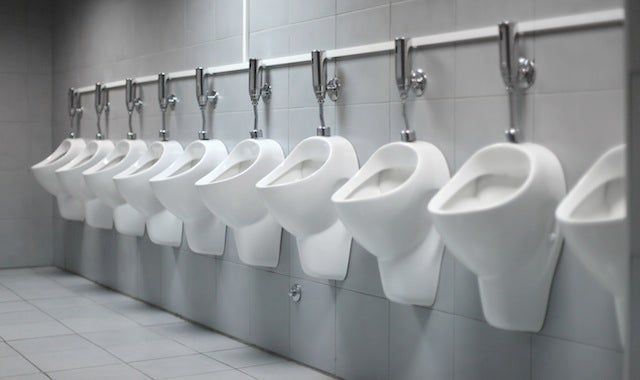
Where is `white ceramic urinals`? white ceramic urinals is located at coordinates (50, 169), (61, 169), (96, 174), (134, 180), (186, 185), (241, 196), (292, 188), (381, 188), (505, 190), (589, 204).